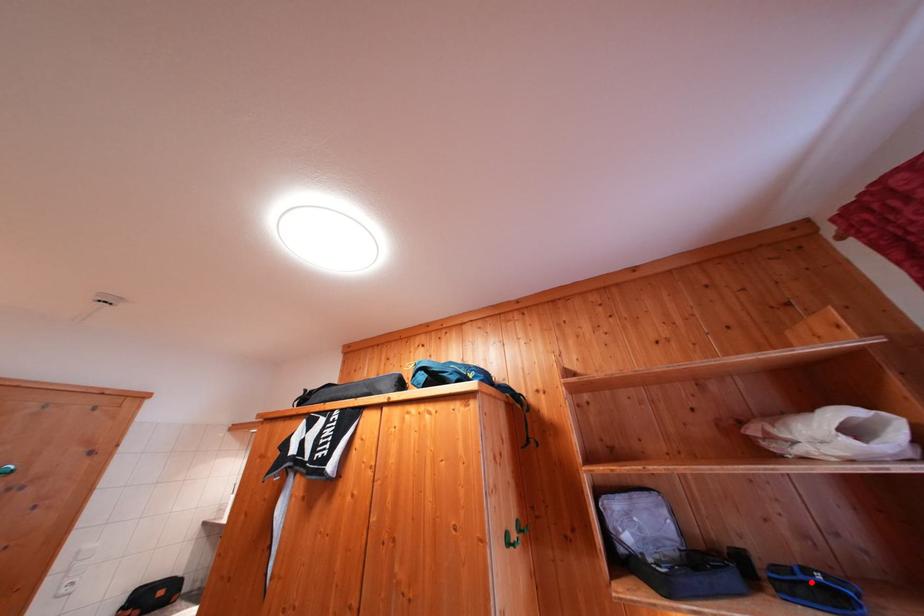
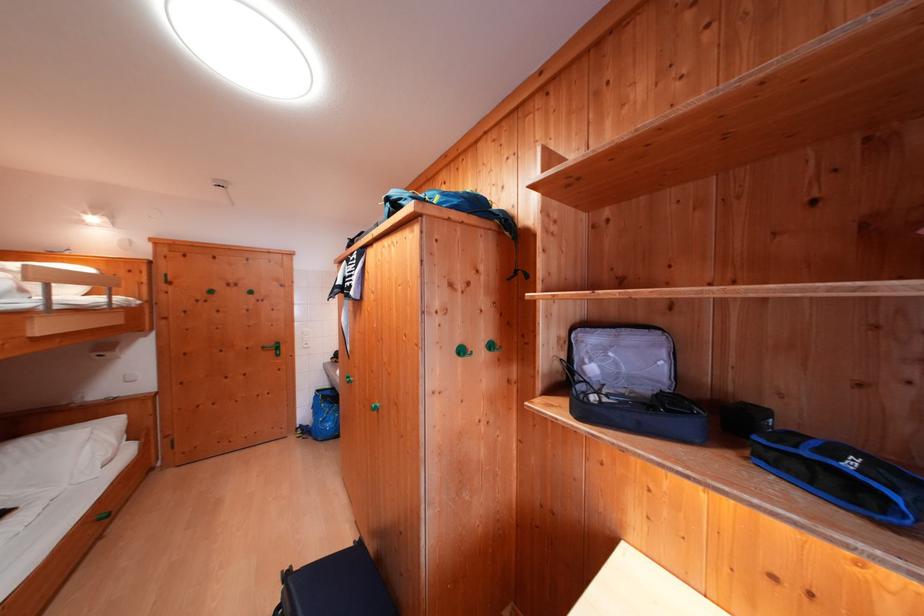
Question: I am providing you with two images of the same scene from different viewpoints. Image1 has a red point marked. In image2, the corresponding 3D location appears at what relative position? Reply with the corresponding letter.

Choices:
 (A) Closer
 (B) Farther

Answer: (B)